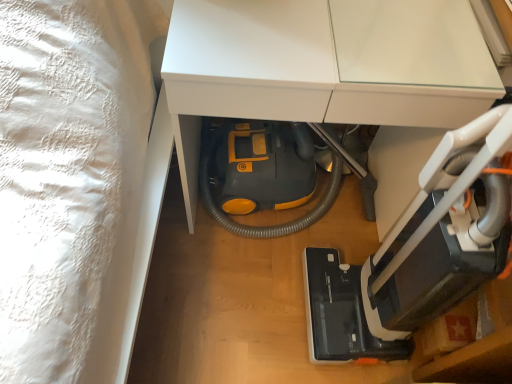
Image resolution: width=512 pixels, height=384 pixels. Describe the element at coordinates (323, 66) in the screenshot. I see `yellow plastic vacuum cleaner at lower center` at that location.

The height and width of the screenshot is (384, 512). In order to click on yellow plastic vacuum cleaner at lower center in this screenshot , I will do `click(323, 66)`.

Measure the distance between black plastic vacuum cleaner at lower right and camera.

The distance of black plastic vacuum cleaner at lower right from camera is 24.80 inches.

Where is `black plastic vacuum cleaner at lower right`? The image size is (512, 384). black plastic vacuum cleaner at lower right is located at coordinates (418, 252).

What do you see at coordinates (418, 252) in the screenshot? This screenshot has width=512, height=384. I see `black plastic vacuum cleaner at lower right` at bounding box center [418, 252].

This screenshot has width=512, height=384. In order to click on yellow plastic vacuum cleaner at lower center in this screenshot , I will do `click(323, 66)`.

Which object is positioned more to the left, yellow plastic vacuum cleaner at lower center or black plastic vacuum cleaner at lower right?

Positioned to the left is yellow plastic vacuum cleaner at lower center.

Is yellow plastic vacuum cleaner at lower center further to the viewer compared to black plastic vacuum cleaner at lower right?

Yes, the depth of yellow plastic vacuum cleaner at lower center is greater than that of black plastic vacuum cleaner at lower right.

Is point (170, 104) in front of point (496, 144)?

No, (170, 104) is behind (496, 144).

From the image's perspective, between yellow plastic vacuum cleaner at lower center and black plastic vacuum cleaner at lower right, which one is located above?

yellow plastic vacuum cleaner at lower center, from the image's perspective.

From a real-world perspective, is yellow plastic vacuum cleaner at lower center physically located above or below black plastic vacuum cleaner at lower right?

yellow plastic vacuum cleaner at lower center is below black plastic vacuum cleaner at lower right.

Does yellow plastic vacuum cleaner at lower center have a greater width compared to black plastic vacuum cleaner at lower right?

Correct, the width of yellow plastic vacuum cleaner at lower center exceeds that of black plastic vacuum cleaner at lower right.

Consider the image. Considering the sizes of objects yellow plastic vacuum cleaner at lower center and black plastic vacuum cleaner at lower right in the image provided, who is shorter, yellow plastic vacuum cleaner at lower center or black plastic vacuum cleaner at lower right?

yellow plastic vacuum cleaner at lower center is shorter.

Which of these two, yellow plastic vacuum cleaner at lower center or black plastic vacuum cleaner at lower right, is bigger?

yellow plastic vacuum cleaner at lower center.

Is black plastic vacuum cleaner at lower right completely or partially inside yellow plastic vacuum cleaner at lower center?

No, black plastic vacuum cleaner at lower right is not a part of yellow plastic vacuum cleaner at lower center.

Is yellow plastic vacuum cleaner at lower center not near black plastic vacuum cleaner at lower right?

No, yellow plastic vacuum cleaner at lower center is not far away from black plastic vacuum cleaner at lower right.

Consider the image. Is yellow plastic vacuum cleaner at lower center oriented towards black plastic vacuum cleaner at lower right?

Yes, yellow plastic vacuum cleaner at lower center faces towards black plastic vacuum cleaner at lower right.

How many degrees apart are the facing directions of yellow plastic vacuum cleaner at lower center and black plastic vacuum cleaner at lower right?

The angular difference between yellow plastic vacuum cleaner at lower center and black plastic vacuum cleaner at lower right is 90 degrees.

I want to click on equipment that is below the yellow plastic vacuum cleaner at lower center (from the image's perspective), so click(418, 252).

Does black plastic vacuum cleaner at lower right appear on the left side of yellow plastic vacuum cleaner at lower center?

No, black plastic vacuum cleaner at lower right is not to the left of yellow plastic vacuum cleaner at lower center.

From the picture: Relative to yellow plastic vacuum cleaner at lower center, is black plastic vacuum cleaner at lower right in front or behind?

black plastic vacuum cleaner at lower right is positioned closer to the viewer than yellow plastic vacuum cleaner at lower center.

Between point (327, 304) and point (330, 28), which one is positioned in front?

Positioned in front is point (330, 28).

From the image's perspective, between black plastic vacuum cleaner at lower right and yellow plastic vacuum cleaner at lower center, who is located below?

From the image's view, black plastic vacuum cleaner at lower right is below.

From a real-world perspective, which is physically above, black plastic vacuum cleaner at lower right or yellow plastic vacuum cleaner at lower center?

black plastic vacuum cleaner at lower right is physically above.

Is black plastic vacuum cleaner at lower right wider than yellow plastic vacuum cleaner at lower center?

No.

Considering the relative sizes of black plastic vacuum cleaner at lower right and yellow plastic vacuum cleaner at lower center in the image provided, is black plastic vacuum cleaner at lower right taller than yellow plastic vacuum cleaner at lower center?

Yes.

Does black plastic vacuum cleaner at lower right have a larger size compared to yellow plastic vacuum cleaner at lower center?

No, black plastic vacuum cleaner at lower right is not bigger than yellow plastic vacuum cleaner at lower center.

Is black plastic vacuum cleaner at lower right not inside yellow plastic vacuum cleaner at lower center?

Absolutely, black plastic vacuum cleaner at lower right is external to yellow plastic vacuum cleaner at lower center.

Is black plastic vacuum cleaner at lower right not close to yellow plastic vacuum cleaner at lower center?

No, black plastic vacuum cleaner at lower right is not far away from yellow plastic vacuum cleaner at lower center.

Is black plastic vacuum cleaner at lower right facing away from yellow plastic vacuum cleaner at lower center?

No, yellow plastic vacuum cleaner at lower center is not at the back of black plastic vacuum cleaner at lower right.

What's the angular difference between black plastic vacuum cleaner at lower right and yellow plastic vacuum cleaner at lower center's facing directions?

90 degrees separate the facing orientations of black plastic vacuum cleaner at lower right and yellow plastic vacuum cleaner at lower center.

Where is `furniture beneath the black plastic vacuum cleaner at lower right (from a real-world perspective)`? The image size is (512, 384). furniture beneath the black plastic vacuum cleaner at lower right (from a real-world perspective) is located at coordinates (323, 66).

At what (x,y) coordinates should I click in order to perform the action: click on furniture below the black plastic vacuum cleaner at lower right (from a real-world perspective). Please return your answer as a coordinate pair (x, y). Looking at the image, I should click on (323, 66).

Locate an element on the screen. The image size is (512, 384). equipment in front of the yellow plastic vacuum cleaner at lower center is located at coordinates (418, 252).